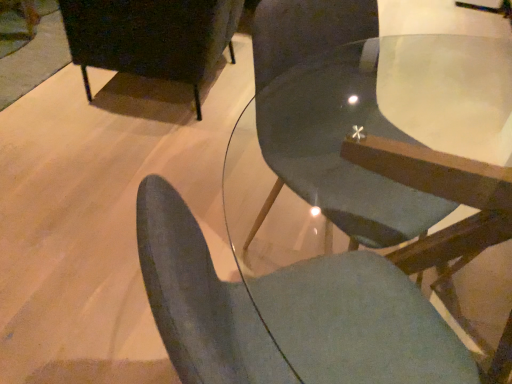
The image size is (512, 384). What do you see at coordinates (329, 118) in the screenshot?
I see `matte gray chair at center, which is the second chair from back to front` at bounding box center [329, 118].

You are a GUI agent. You are given a task and a screenshot of the screen. Output one action in this format:
    pyautogui.click(x=<x>, y=<y>)
    Task: Click on the matte gray chair at center, the first chair when ordered from front to back
    The width and height of the screenshot is (512, 384).
    Given the screenshot: What is the action you would take?
    pyautogui.click(x=200, y=299)

Between matte gray chair at center, the first chair when ordered from front to back, and matte gray chair at center, acting as the 2th chair starting from the front, which one appears on the right side from the viewer's perspective?

Positioned to the right is matte gray chair at center, acting as the 2th chair starting from the front.

Is matte gray chair at center, the first chair when ordered from front to back, taller than matte gray chair at center, acting as the 2th chair starting from the front?

In fact, matte gray chair at center, the first chair when ordered from front to back, may be shorter than matte gray chair at center, acting as the 2th chair starting from the front.

How many degrees apart are the facing directions of matte gray chair at center, which appears as the 3th chair when viewed from the back, and matte gray chair at center, which is the second chair from back to front?

matte gray chair at center, which appears as the 3th chair when viewed from the back, and matte gray chair at center, which is the second chair from back to front, are facing 73 degrees away from each other.

Are matte gray chair at center, which appears as the 3th chair when viewed from the back, and matte gray chair at center, which is the second chair from back to front, far apart?

They are positioned close to each other.

From a real-world perspective, who is located higher, matte black chair at upper left, positioned as the first chair in back-to-front order, or matte gray chair at center, which appears as the 3th chair when viewed from the back?

matte gray chair at center, which appears as the 3th chair when viewed from the back, from a real-world perspective.

Is point (145, 2) closer or farther from the camera than point (250, 350)?

Point (145, 2).

Is matte black chair at upper left, the third chair viewed from the front, taller or shorter than matte gray chair at center, the first chair when ordered from front to back?

Considering their sizes, matte black chair at upper left, the third chair viewed from the front, has less height than matte gray chair at center, the first chair when ordered from front to back.

Is matte gray chair at center, the first chair when ordered from front to back, inside matte black chair at upper left, positioned as the first chair in back-to-front order?

No, matte black chair at upper left, positioned as the first chair in back-to-front order, does not contain matte gray chair at center, the first chair when ordered from front to back.

Considering the positions of objects matte black chair at upper left, positioned as the first chair in back-to-front order, and matte gray chair at center, which is the second chair from back to front, in the image provided, who is more to the left, matte black chair at upper left, positioned as the first chair in back-to-front order, or matte gray chair at center, which is the second chair from back to front,?

Positioned to the left is matte black chair at upper left, positioned as the first chair in back-to-front order.

From the image's perspective, starting from the matte black chair at upper left, the third chair viewed from the front, which chair is the 1st one below? Please provide its 2D coordinates.

[(329, 118)]

Considering the sizes of objects matte black chair at upper left, the third chair viewed from the front, and matte gray chair at center, which is the second chair from back to front, in the image provided, who is smaller, matte black chair at upper left, the third chair viewed from the front, or matte gray chair at center, which is the second chair from back to front,?

matte gray chair at center, which is the second chair from back to front.

Considering the sizes of objects matte black chair at upper left, positioned as the first chair in back-to-front order, and matte gray chair at center, which is the second chair from back to front, in the image provided, who is thinner, matte black chair at upper left, positioned as the first chair in back-to-front order, or matte gray chair at center, which is the second chair from back to front,?

matte gray chair at center, which is the second chair from back to front.

Is matte gray chair at center, which is the second chair from back to front, located outside matte gray chair at center, the first chair when ordered from front to back?

Yes, matte gray chair at center, which is the second chair from back to front, is located beyond the bounds of matte gray chair at center, the first chair when ordered from front to back.

Does matte gray chair at center, acting as the 2th chair starting from the front, have a smaller size compared to matte gray chair at center, the first chair when ordered from front to back?

Incorrect, matte gray chair at center, acting as the 2th chair starting from the front, is not smaller in size than matte gray chair at center, the first chair when ordered from front to back.

From the image's perspective, is matte gray chair at center, which is the second chair from back to front, above or below matte gray chair at center, the first chair when ordered from front to back?

matte gray chair at center, which is the second chair from back to front, is situated higher than matte gray chair at center, the first chair when ordered from front to back, in the image.

How many degrees apart are the facing directions of matte gray chair at center, acting as the 2th chair starting from the front, and matte black chair at upper left, the third chair viewed from the front?

They differ by 146 degrees in their facing directions.

Between matte gray chair at center, which is the second chair from back to front, and matte black chair at upper left, positioned as the first chair in back-to-front order, which one has smaller width?

matte gray chair at center, which is the second chair from back to front, is thinner.

Considering the positions of points (283, 70) and (221, 22), is point (283, 70) farther from camera compared to point (221, 22)?

That is False.

The image size is (512, 384). I want to click on chair behind the matte gray chair at center, acting as the 2th chair starting from the front, so click(151, 37).

How many degrees apart are the facing directions of matte gray chair at center, the first chair when ordered from front to back, and matte black chair at upper left, positioned as the first chair in back-to-front order?

The facing directions of matte gray chair at center, the first chair when ordered from front to back, and matte black chair at upper left, positioned as the first chair in back-to-front order, are 141 degrees apart.

Identify the location of the 2nd chair below when counting from the matte black chair at upper left, positioned as the first chair in back-to-front order (from the image's perspective). (200, 299).

Is point (192, 249) behind point (184, 38)?

No, (192, 249) is in front of (184, 38).

Measure the distance from matte gray chair at center, which appears as the 3th chair when viewed from the back, to matte black chair at upper left, the third chair viewed from the front.

1.41 meters.

This screenshot has height=384, width=512. I want to click on chair above the matte gray chair at center, the first chair when ordered from front to back (from a real-world perspective), so click(329, 118).

Locate an element on the screen. the 2nd chair above the matte gray chair at center, the first chair when ordered from front to back (from the image's perspective) is located at coordinates (151, 37).

Looking at this image, from the image, which object appears to be nearer to matte gray chair at center, which is the second chair from back to front, matte gray chair at center, which appears as the 3th chair when viewed from the back, or matte black chair at upper left, the third chair viewed from the front?

The object closer to matte gray chair at center, which is the second chair from back to front, is matte gray chair at center, which appears as the 3th chair when viewed from the back.

From the image, which object appears to be farther from matte gray chair at center, which is the second chair from back to front, matte black chair at upper left, positioned as the first chair in back-to-front order, or matte gray chair at center, which appears as the 3th chair when viewed from the back?

Based on the image, matte black chair at upper left, positioned as the first chair in back-to-front order, appears to be further to matte gray chair at center, which is the second chair from back to front.

From the image, which object appears to be nearer to matte black chair at upper left, positioned as the first chair in back-to-front order, matte gray chair at center, the first chair when ordered from front to back, or matte gray chair at center, which is the second chair from back to front?

Among the two, matte gray chair at center, which is the second chair from back to front, is located nearer to matte black chair at upper left, positioned as the first chair in back-to-front order.

Estimate the real-world distances between objects in this image. Which object is closer to matte gray chair at center, which appears as the 3th chair when viewed from the back, matte gray chair at center, which is the second chair from back to front, or matte black chair at upper left, positioned as the first chair in back-to-front order?

matte gray chair at center, which is the second chair from back to front.

Estimate the real-world distances between objects in this image. Which object is closer to matte gray chair at center, which appears as the 3th chair when viewed from the back, matte black chair at upper left, positioned as the first chair in back-to-front order, or matte gray chair at center, acting as the 2th chair starting from the front?

matte gray chair at center, acting as the 2th chair starting from the front, lies closer to matte gray chair at center, which appears as the 3th chair when viewed from the back, than the other object.

When comparing their distances from matte black chair at upper left, positioned as the first chair in back-to-front order, does matte gray chair at center, which is the second chair from back to front, or matte gray chair at center, the first chair when ordered from front to back, seem closer?

Based on the image, matte gray chair at center, which is the second chair from back to front, appears to be nearer to matte black chair at upper left, positioned as the first chair in back-to-front order.

Where is `chair between matte gray chair at center, the first chair when ordered from front to back, and matte black chair at upper left, positioned as the first chair in back-to-front order, from front to back`? chair between matte gray chair at center, the first chair when ordered from front to back, and matte black chair at upper left, positioned as the first chair in back-to-front order, from front to back is located at coordinates pos(329,118).